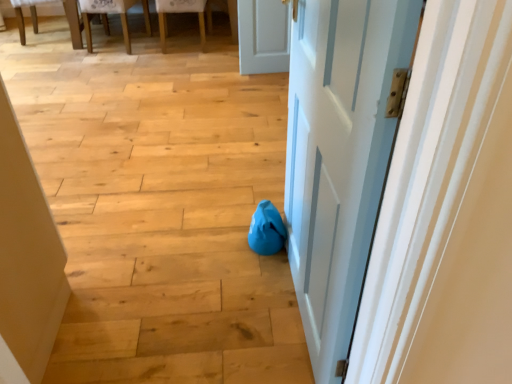
Where is `unoccupied area in front of blue fabric bean bag at center`? unoccupied area in front of blue fabric bean bag at center is located at coordinates (257, 269).